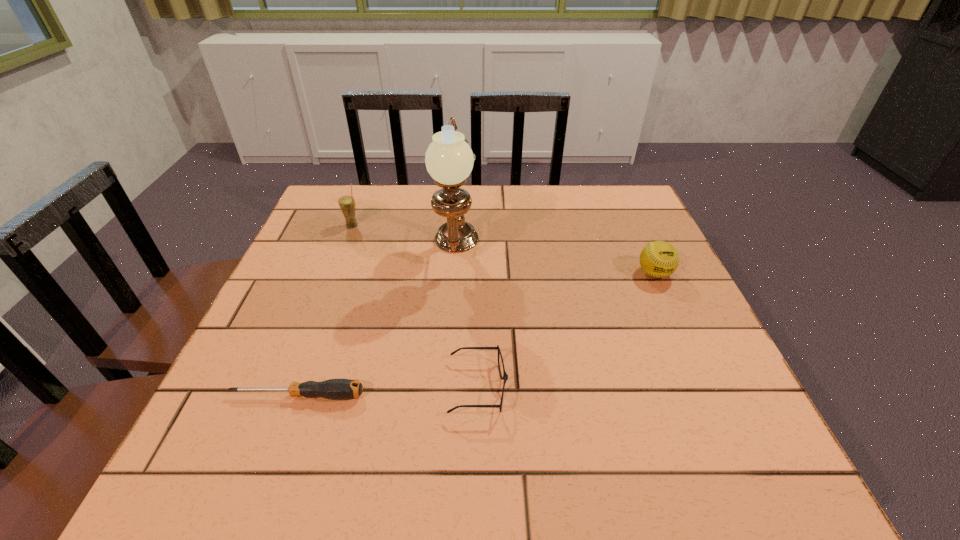
Identify the location of vacant space that's between the screwdriver and the straw for drinking. Image resolution: width=960 pixels, height=540 pixels. click(x=325, y=310).

Where is `free space between the oil lamp and the screwdriver`? The height and width of the screenshot is (540, 960). free space between the oil lamp and the screwdriver is located at coordinates (377, 325).

This screenshot has height=540, width=960. What are the coordinates of `unoccupied position between the straw for drinking and the spectacles` in the screenshot? It's located at (415, 307).

What are the coordinates of `object that stands as the fourth closest to the spectacles` in the screenshot? It's located at (347, 204).

Identify which object is the nearest to the shortest object. Please provide its 2D coordinates. Your answer should be formatted as a tuple, i.e. [(x, y)], where the tuple contains the x and y coordinates of a point satisfying the conditions above.

[(505, 377)]

The height and width of the screenshot is (540, 960). I want to click on vacant area in the image that satisfies the following two spatial constraints: 1. on the front side of the screwdriver; 2. on the right side of the straw for drinking, so tap(287, 396).